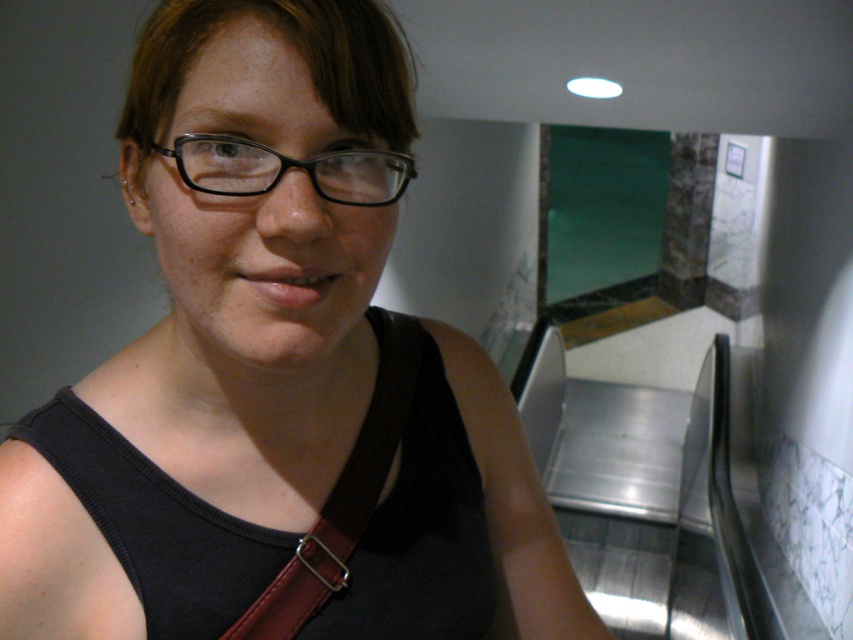
You are an observer in the subway station. You notice a person wearing a black fabric tank top at center and a brown leather strap at center. Which item is positioned nearer to you?

The black fabric tank top at center is closer to the viewer than the brown leather strap at center.

You are an interior designer planning to install a new handrail on the escalator. The current handrail is 36.39 centimeters away from the black fabric tank top at center. Is this distance sufficient for safety standards requiring at least 40 centimeters between the handrail and any obstruction?

The current handrail is 36.39 centimeters away from the black fabric tank top at center, which is below the required 40 centimeters for safety standards. Therefore, the distance is insufficient and adjustments are needed.